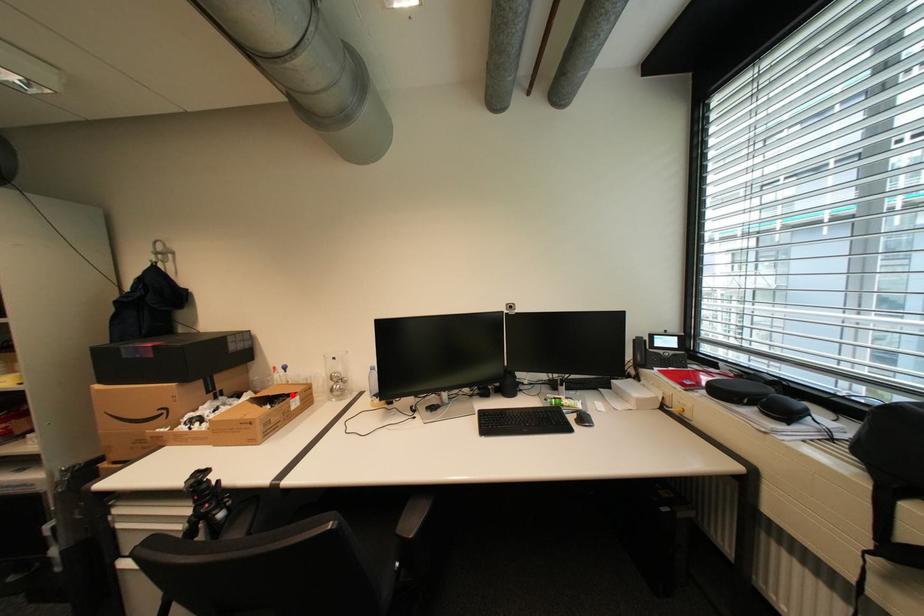
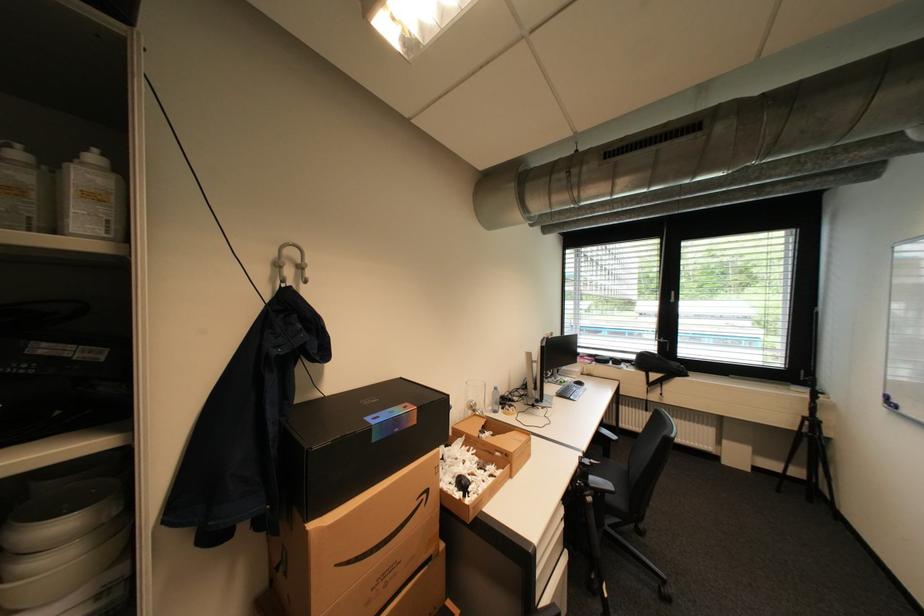
The point at the highlighted location is marked in the first image. Where is the corresponding point in the second image?

(492, 426)